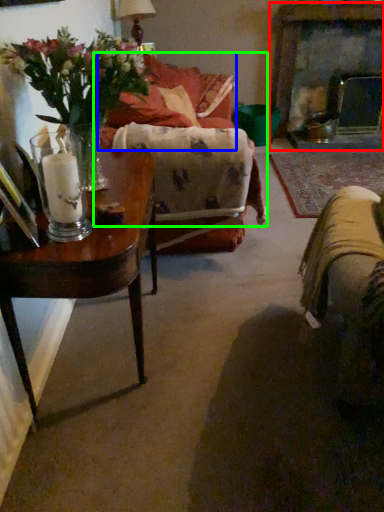
Question: Which object is positioned closest to fireplace (highlighted by a red box)? Select from couch (highlighted by a blue box) and couch (highlighted by a green box).

Choices:
 (A) couch
 (B) couch

Answer: (A)